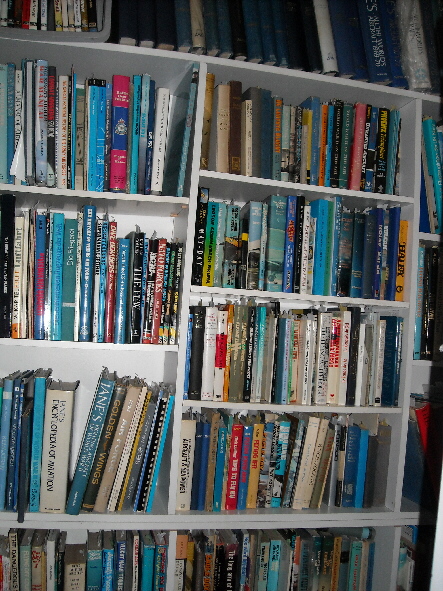
Locate an element on the screen. The height and width of the screenshot is (591, 443). books on the highest shelf is located at coordinates (385, 45), (322, 53), (268, 28), (219, 28).